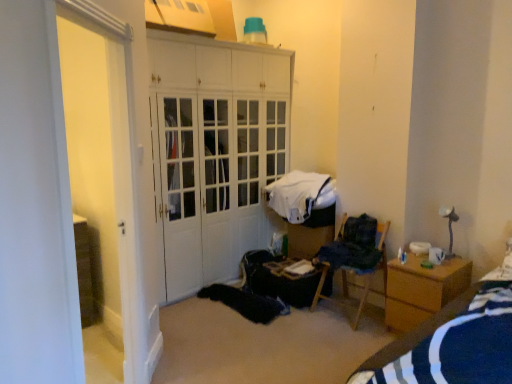
Image resolution: width=512 pixels, height=384 pixels. Find the location of `vacant space situated above wooden nightstand at right (from a real-world perspective)`. vacant space situated above wooden nightstand at right (from a real-world perspective) is located at coordinates (434, 264).